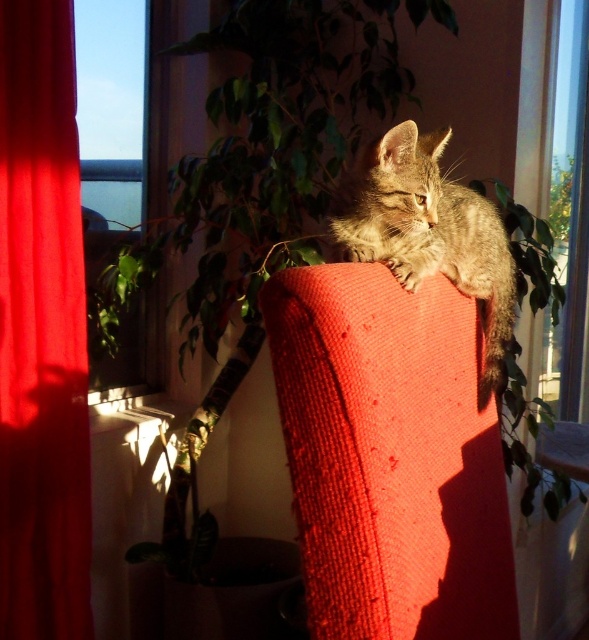
Based on the photo, does matte red armchair at center appear on the right side of transparent glass window at upper left?

Yes, matte red armchair at center is to the right of transparent glass window at upper left.

Is matte red armchair at center positioned behind transparent glass window at upper left?

No.

Does point (396, 294) come behind point (160, 339)?

No, (396, 294) is closer to viewer.

Where is `matte red armchair at center`? matte red armchair at center is located at coordinates (389, 456).

Where is `matte red armchair at center`? Image resolution: width=589 pixels, height=640 pixels. matte red armchair at center is located at coordinates (389, 456).

Is the position of matte red armchair at center more distant than that of tabby fur cat at center?

No.

Based on the photo, who is more forward, (378,520) or (498,244)?

Point (378,520) is in front.

I want to click on matte red armchair at center, so click(389, 456).

Is matte red curtain at left to the right of transparent glass window at upper left from the viewer's perspective?

In fact, matte red curtain at left is to the left of transparent glass window at upper left.

You are a GUI agent. You are given a task and a screenshot of the screen. Output one action in this format:
    pyautogui.click(x=<x>, y=<y>)
    Task: Click on the matte red curtain at left
    This screenshot has width=589, height=640.
    Given the screenshot: What is the action you would take?
    pyautogui.click(x=41, y=332)